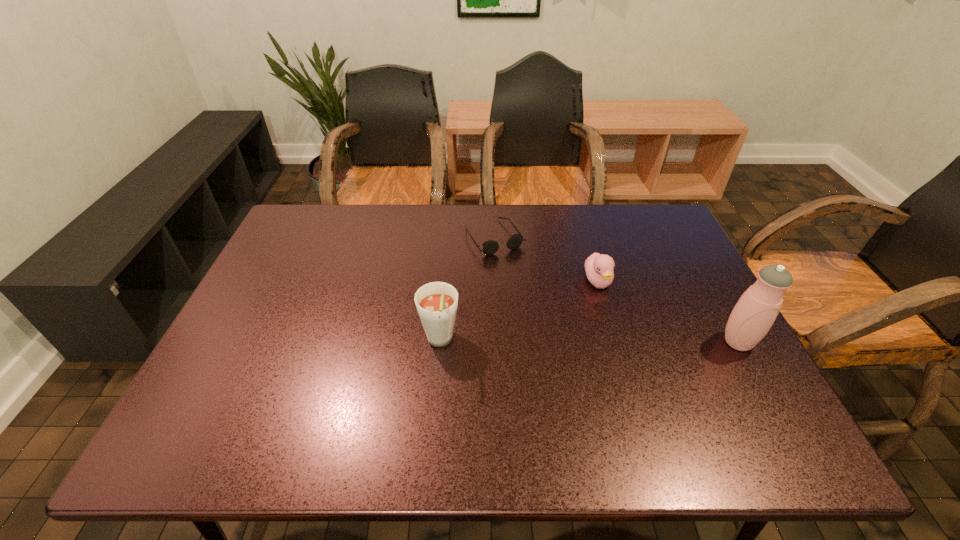
In order to click on the second tallest object in this screenshot , I will do `click(436, 302)`.

At what (x,y) coordinates should I click in order to perform the action: click on root beer. Please return your answer as a coordinate pair (x, y). Looking at the image, I should click on (436, 302).

Locate an element on the screen. This screenshot has height=540, width=960. the tallest object is located at coordinates (755, 312).

Locate an element on the screen. the rightmost object is located at coordinates (755, 312).

This screenshot has width=960, height=540. Identify the location of the farthest object. (490, 247).

The image size is (960, 540). I want to click on the shortest object, so [490, 247].

The image size is (960, 540). I want to click on the second shortest object, so click(599, 268).

Find the location of a particular element. This screenshot has width=960, height=540. duckling is located at coordinates (599, 268).

Where is `vacant region located on the back of the thermos bottle`? The width and height of the screenshot is (960, 540). vacant region located on the back of the thermos bottle is located at coordinates (713, 298).

Locate an element on the screen. The image size is (960, 540). free space located on the front-facing side of the second object from left to right is located at coordinates (521, 278).